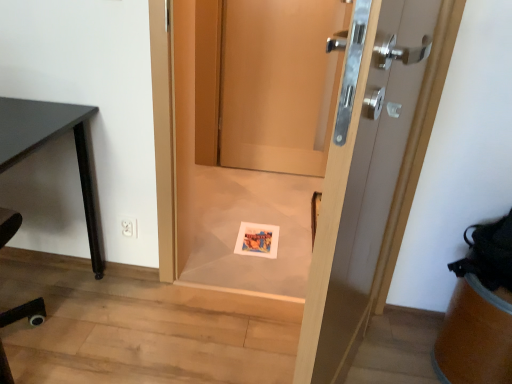
The height and width of the screenshot is (384, 512). Find the location of `free spot to the right of matte black desk at left`. free spot to the right of matte black desk at left is located at coordinates (150, 327).